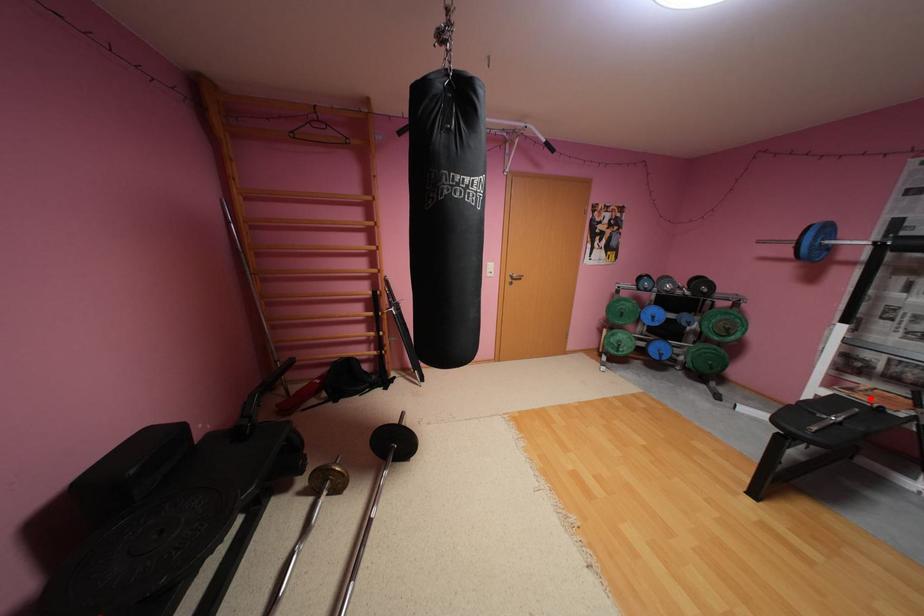
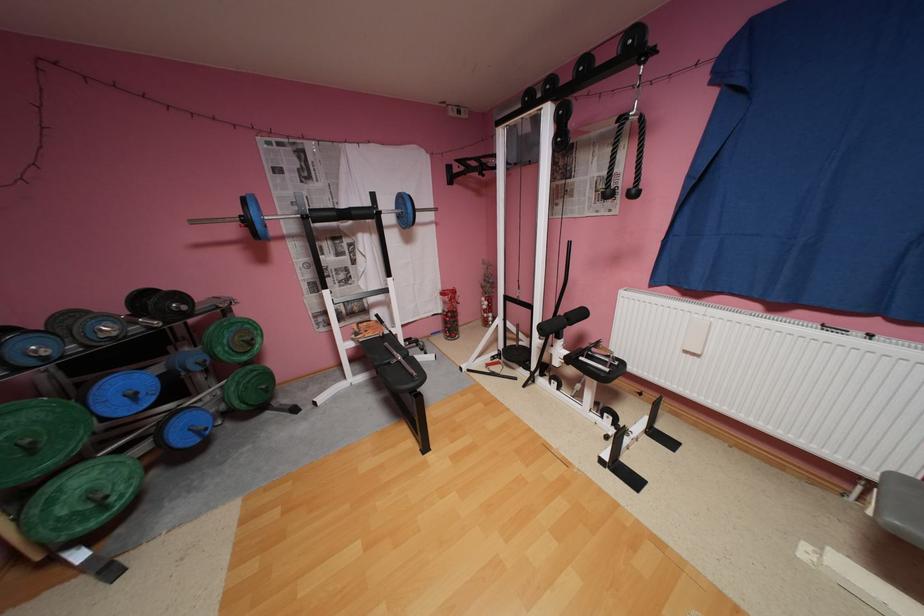
Question: I am providing you with two images of the same scene from different viewpoints. Given a red point in image1, look at the same physical point in image2. Is it:

Choices:
 (A) Closer to the viewpoint
 (B) Farther from the viewpoint

Answer: (A)